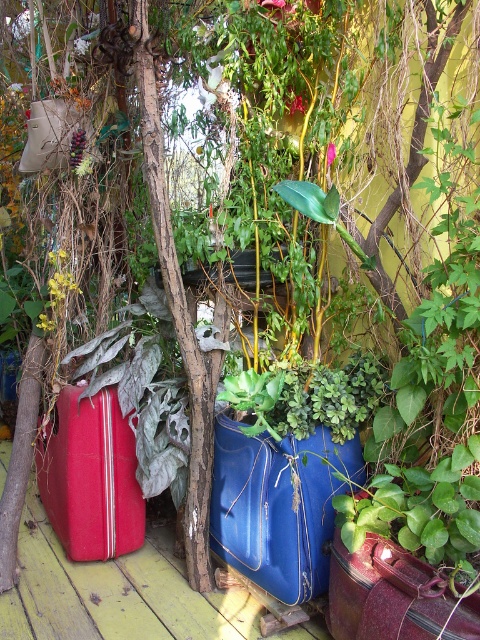
Between matte red suitcase at left and rusty metallic suitcase at center, which one is positioned lower?

rusty metallic suitcase at center is below.

Consider the image. Does matte red suitcase at left have a greater height compared to rusty metallic suitcase at center?

Yes, matte red suitcase at left is taller than rusty metallic suitcase at center.

This screenshot has height=640, width=480. What do you see at coordinates (91, 476) in the screenshot?
I see `matte red suitcase at left` at bounding box center [91, 476].

This screenshot has height=640, width=480. In order to click on matte red suitcase at left in this screenshot , I will do `click(91, 476)`.

Can you confirm if matte red suitcase at lower left is positioned to the left of rusty metallic suitcase at center?

Yes, matte red suitcase at lower left is to the left of rusty metallic suitcase at center.

Is matte red suitcase at lower left wider than rusty metallic suitcase at center?

Correct, the width of matte red suitcase at lower left exceeds that of rusty metallic suitcase at center.

Between point (177, 616) and point (408, 595), which one is positioned in front?

Point (408, 595) is in front.

The image size is (480, 640). Identify the location of matte red suitcase at lower left. (113, 593).

Between point (147, 621) and point (39, 451), which one is positioned in front?

Positioned in front is point (147, 621).

I want to click on matte red suitcase at lower left, so click(x=113, y=593).